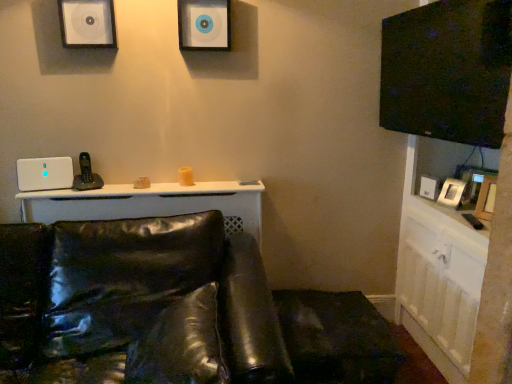
Question: Considering the relative positions of matte white speaker at upper center, the 3th speaker positioned from the bottom, and white matte speaker at upper left, arranged as the second speaker when viewed from the right, in the image provided, is matte white speaker at upper center, the 3th speaker positioned from the bottom, to the left of white matte speaker at upper left, arranged as the second speaker when viewed from the right, from the viewer's perspective?

Choices:
 (A) no
 (B) yes

Answer: (A)

Question: Is matte white speaker at upper center, which is the 3th speaker from left to right, far from white matte speaker at upper left, placed as the 2th speaker when sorted from left to right?

Choices:
 (A) no
 (B) yes

Answer: (A)

Question: Would you say white matte speaker at upper left, arranged as the second speaker when viewed from the right, is part of matte white speaker at upper center, positioned as the 1th speaker in top-to-bottom order,'s contents?

Choices:
 (A) yes
 (B) no

Answer: (B)

Question: Is matte white speaker at upper center, the 3th speaker positioned from the bottom, taller than white matte speaker at upper left, arranged as the second speaker when viewed from the right?

Choices:
 (A) yes
 (B) no

Answer: (B)

Question: Is matte white speaker at upper center, which is the 3th speaker from left to right, not within white matte speaker at upper left, arranged as the second speaker when viewed from the right?

Choices:
 (A) no
 (B) yes

Answer: (B)

Question: Is matte white speaker at upper center, positioned as the 1th speaker in top-to-bottom order, shorter than white matte speaker at upper left, placed as the 2th speaker when sorted from left to right?

Choices:
 (A) no
 (B) yes

Answer: (B)

Question: Is white glossy dresser at right turned away from white plastic speaker at left, placed as the 1th speaker when sorted from bottom to top?

Choices:
 (A) yes
 (B) no

Answer: (B)

Question: From a real-world perspective, is white glossy dresser at right beneath white plastic speaker at left, placed as the 1th speaker when sorted from bottom to top?

Choices:
 (A) no
 (B) yes

Answer: (B)

Question: Is white glossy dresser at right completely or partially outside of white plastic speaker at left, placed as the 1th speaker when sorted from bottom to top?

Choices:
 (A) yes
 (B) no

Answer: (A)

Question: From the image's perspective, is white glossy dresser at right located beneath white plastic speaker at left, which is the first speaker from left to right?

Choices:
 (A) no
 (B) yes

Answer: (B)

Question: From a real-world perspective, does white glossy dresser at right stand above white plastic speaker at left, which is the first speaker from left to right?

Choices:
 (A) yes
 (B) no

Answer: (B)

Question: Considering the relative sizes of white glossy dresser at right and white plastic speaker at left, which appears as the third speaker when viewed from the right, in the image provided, is white glossy dresser at right taller than white plastic speaker at left, which appears as the third speaker when viewed from the right,?

Choices:
 (A) yes
 (B) no

Answer: (A)

Question: Can you confirm if matte white speaker at upper center, which is the 3th speaker from left to right, is positioned to the left of white plastic speaker at left, positioned as the third speaker in top-to-bottom order?

Choices:
 (A) no
 (B) yes

Answer: (A)